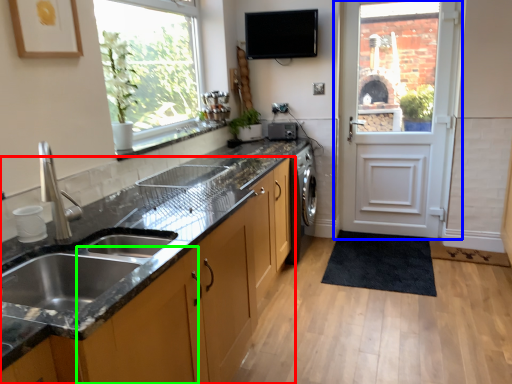
Question: Estimate the real-world distances between objects in this image. Which object is farther from cabinetry (highlighted by a red box), door (highlighted by a blue box) or cabinetry (highlighted by a green box)?

Choices:
 (A) door
 (B) cabinetry

Answer: (A)